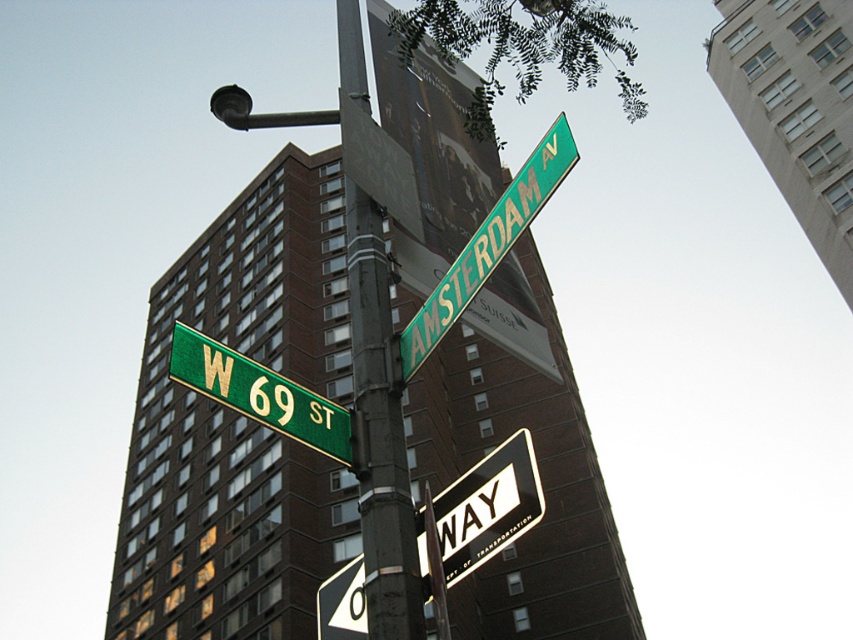
You are a city planner analyzing traffic signs. You see the metallic pole at center and the green matte street sign at upper left. Which object is taller?

The metallic pole at center is taller than the green matte street sign at upper left according to the description.

You are a delivery driver approaching the intersection and need to locate the metallic pole at center and the green matte street sign at upper left. According to the scene, which object is placed higher up?

The metallic pole at center is positioned over the green matte street sign at upper left, so the metallic pole at center is higher up.